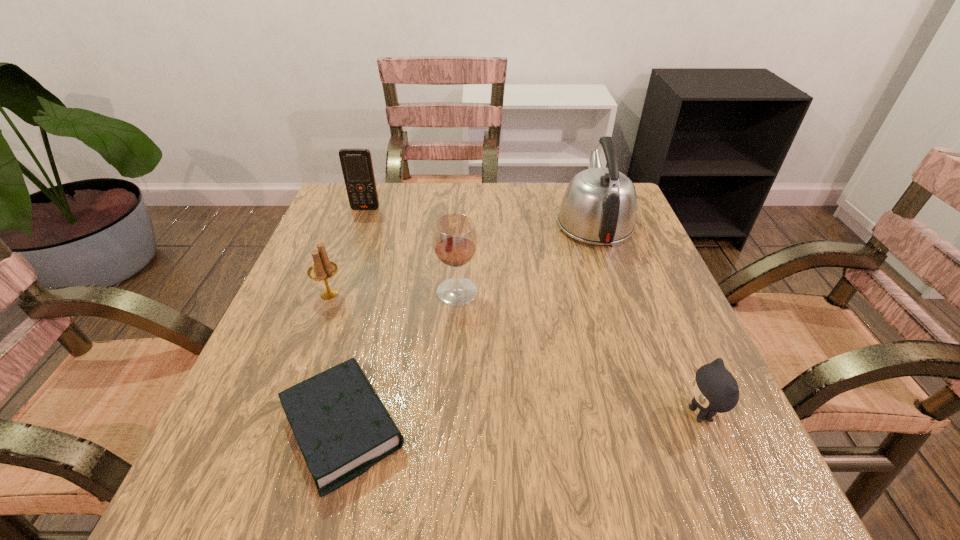
At what (x,y) coordinates should I click in order to perform the action: click on object that is the fourth closest to the wineglass. Please return your answer as a coordinate pair (x, y). This screenshot has width=960, height=540. Looking at the image, I should click on (356, 163).

You are a GUI agent. You are given a task and a screenshot of the screen. Output one action in this format:
    pyautogui.click(x=<x>, y=<y>)
    Task: Click on the object identified as the fourth closest to the third shortest object
    The width and height of the screenshot is (960, 540).
    Given the screenshot: What is the action you would take?
    pyautogui.click(x=599, y=206)

I want to click on free spot that satisfies the following two spatial constraints: 1. on the front-facing side of the fifth tallest object; 2. on the front side of the shortest object, so click(x=707, y=428).

Where is `free space that satisfies the following two spatial constraints: 1. on the back side of the candle holder; 2. on the left side of the wineglass`? The image size is (960, 540). free space that satisfies the following two spatial constraints: 1. on the back side of the candle holder; 2. on the left side of the wineglass is located at coordinates (330, 292).

The height and width of the screenshot is (540, 960). Identify the location of blank area in the image that satisfies the following two spatial constraints: 1. on the back side of the wineglass; 2. on the left side of the shortest object. (378, 292).